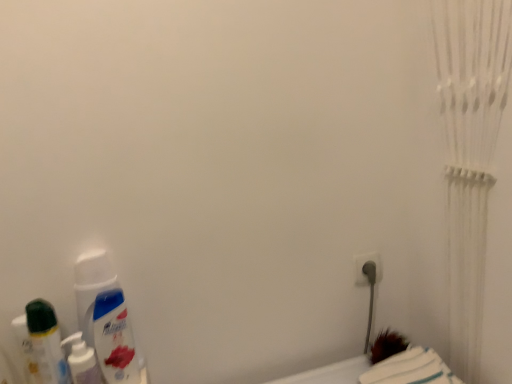
Question: From a real-world perspective, is white plastic plug at lower right physically located above or below white soft towel at lower right?

Choices:
 (A) below
 (B) above

Answer: (B)

Question: In terms of size, does white plastic plug at lower right appear bigger or smaller than white soft towel at lower right?

Choices:
 (A) small
 (B) big

Answer: (A)

Question: Which is nearer to the white plastic plug at lower right?

Choices:
 (A) white glossy mouthwash at lower left, which is the 2th mouthwash in right-to-left order
 (B) translucent plastic mouthwash at lower left, which appears as the first mouthwash when viewed from the left
 (C) white glossy mouthwash at lower left, which ranks as the 1th mouthwash in right-to-left order
 (D) white soft towel at lower right

Answer: (D)

Question: Based on their relative distances, which object is farther from the white soft towel at lower right?

Choices:
 (A) translucent plastic mouthwash at lower left, which appears as the first mouthwash when viewed from the left
 (B) white glossy mouthwash at lower left, which is the second mouthwash from left to right
 (C) white glossy mouthwash at lower left, which appears as the third mouthwash when viewed from the left
 (D) white plastic plug at lower right

Answer: (A)